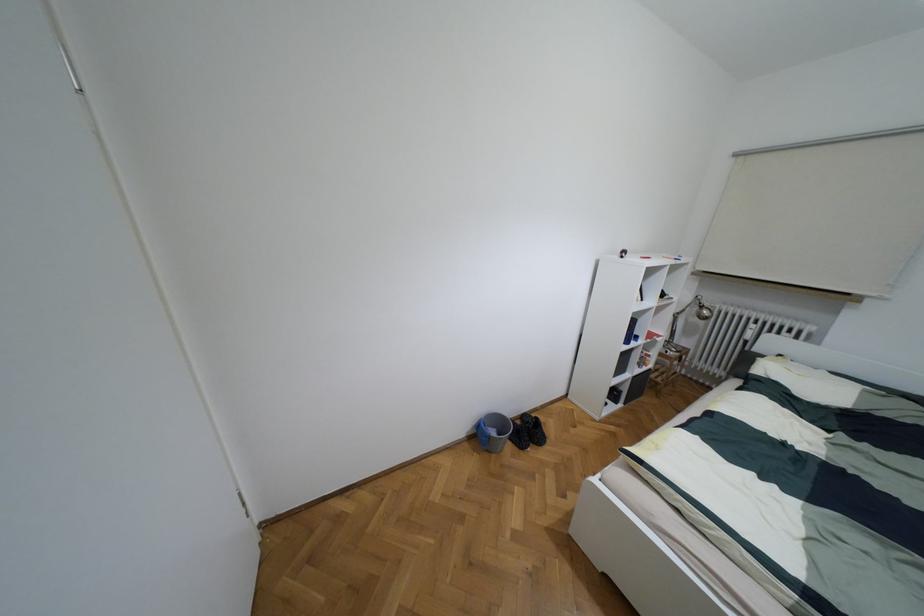
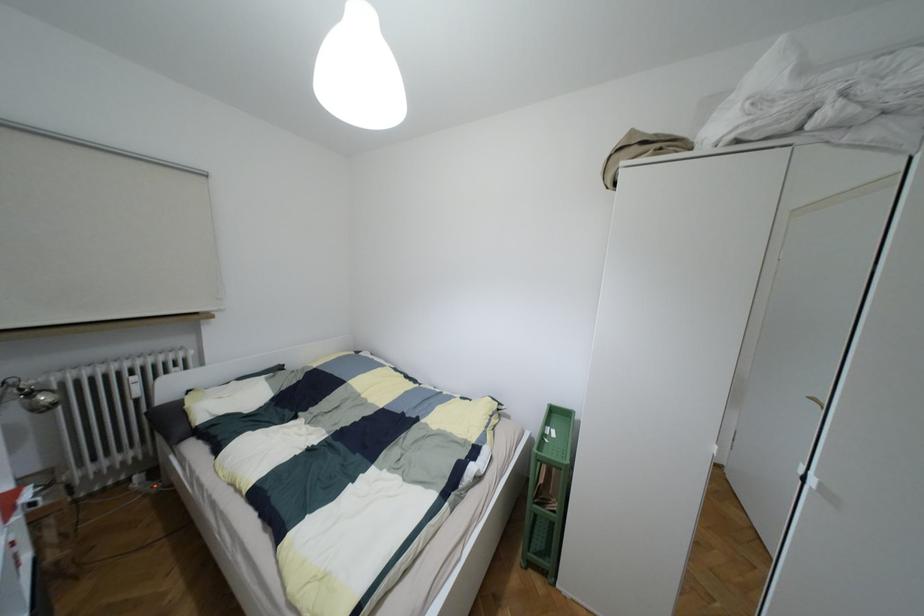
Find the pixel in the second image that matches point (704, 312) in the first image.

(43, 397)